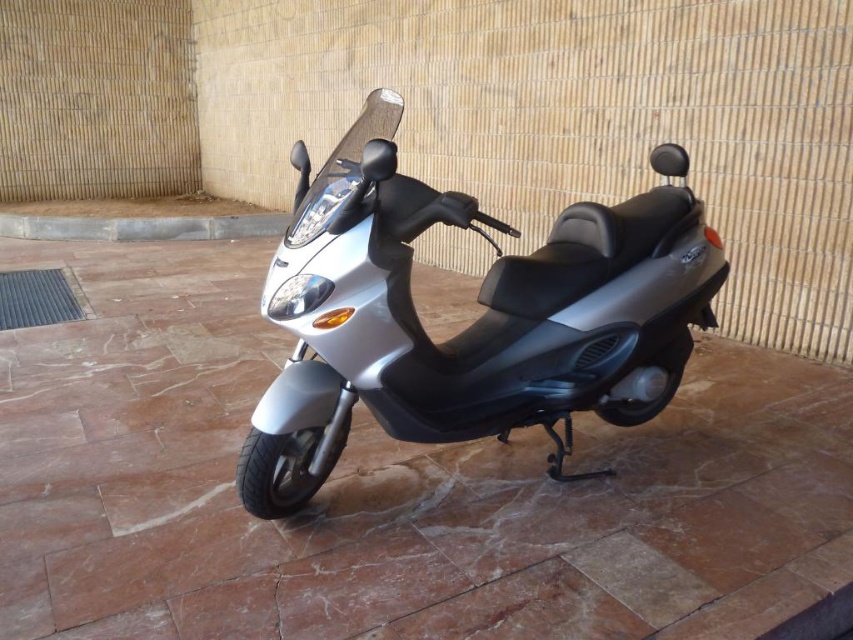
Question: Which point appears closest to the camera in this image?

Choices:
 (A) (397, 232)
 (B) (77, 237)

Answer: (A)

Question: Which of the following is the farthest from the observer?

Choices:
 (A) silver metallic scooter at center
 (B) concrete at lower center

Answer: (B)

Question: Among these objects, which one is farthest from the camera?

Choices:
 (A) silver metallic scooter at center
 (B) concrete at lower center

Answer: (B)

Question: Can you confirm if silver metallic scooter at center is positioned above concrete at lower center?

Choices:
 (A) no
 (B) yes

Answer: (A)

Question: Can you confirm if silver metallic scooter at center is positioned to the left of concrete at lower center?

Choices:
 (A) yes
 (B) no

Answer: (B)

Question: Does silver metallic scooter at center appear on the right side of concrete at lower center?

Choices:
 (A) yes
 (B) no

Answer: (A)